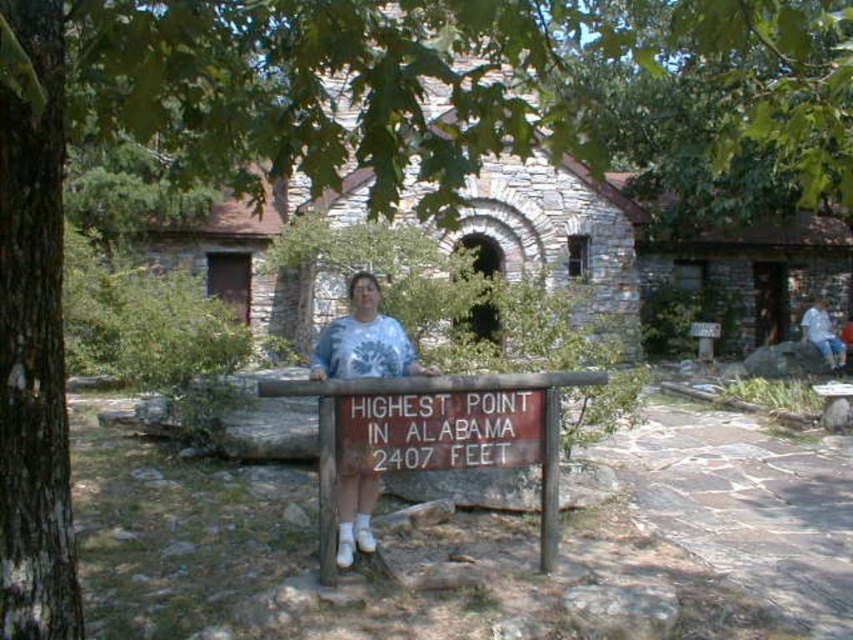
Question: Is brown wooden sign at center positioned before white tie-dye shirt at center?

Choices:
 (A) yes
 (B) no

Answer: (A)

Question: Which of the following is the closest to the observer?

Choices:
 (A) (474, 440)
 (B) (824, 358)
 (C) (329, 326)

Answer: (A)

Question: Which object appears farthest from the camera in this image?

Choices:
 (A) blue denim jeans at right
 (B) white tie-dye shirt at center

Answer: (A)

Question: Can you confirm if brown wooden sign at center is positioned above blue denim jeans at right?

Choices:
 (A) no
 (B) yes

Answer: (A)

Question: Observing the image, what is the correct spatial positioning of brown wooden sign at center in reference to blue denim jeans at right?

Choices:
 (A) left
 (B) right

Answer: (A)

Question: Which point is closer to the camera?

Choices:
 (A) click(328, 324)
 (B) click(456, 444)

Answer: (B)